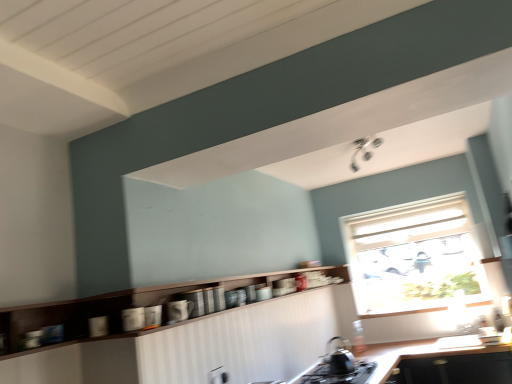
The image size is (512, 384). Find the location of `glossy ceramic mug at lower center, the first appliance viewed from the front`. glossy ceramic mug at lower center, the first appliance viewed from the front is located at coordinates [179, 310].

What is the approximate width of glossy ceramic mug at lower center, the first appliance viewed from the front?

4.16 inches.

The height and width of the screenshot is (384, 512). Find the location of `white textured window at upper right`. white textured window at upper right is located at coordinates click(x=415, y=256).

Find the location of a particular element. The height and width of the screenshot is (384, 512). black matte countertop at lower center is located at coordinates (438, 364).

At what (x,y) coordinates should I click in order to perform the action: click on wooden cabinet at center. Please return your answer as a coordinate pair (x, y). The height and width of the screenshot is (384, 512). Looking at the image, I should click on (104, 311).

From the image's perspective, between black matte gas stove at lower center and matte ceramic mug at center, positioned as the first appliance in back-to-front order, who is located below?

black matte gas stove at lower center, from the image's perspective.

From the picture: Is black matte gas stove at lower center inside the boundaries of matte ceramic mug at center, marked as the second appliance in a front-to-back arrangement, or outside?

black matte gas stove at lower center is spatially situated outside matte ceramic mug at center, marked as the second appliance in a front-to-back arrangement.

Is point (368, 378) in front of point (194, 297)?

No, (368, 378) is further to viewer.

Locate an element on the screen. gas stove positioned vertically above the black matte countertop at lower center (from a real-world perspective) is located at coordinates (340, 374).

Considering the relative positions of black matte countertop at lower center and black matte gas stove at lower center in the image provided, is black matte countertop at lower center to the right of black matte gas stove at lower center from the viewer's perspective?

Yes.

From a real-world perspective, which is physically below, black matte countertop at lower center or black matte gas stove at lower center?

black matte countertop at lower center is physically lower.

Is black matte gas stove at lower center completely or partially inside black matte countertop at lower center?

Yes, black matte gas stove at lower center can be found within black matte countertop at lower center.

Is white textured window at upper right to the left or to the right of black matte gas stove at lower center in the image?

white textured window at upper right is to the right of black matte gas stove at lower center.

Consider the image. Which is less distant, (x=454, y=297) or (x=368, y=365)?

Clearly, point (x=454, y=297) is more distant from the camera than point (x=368, y=365).

Is white textured window at upper right completely or partially outside of black matte gas stove at lower center?

Yes.

In the image, is white textured window at upper right positioned in front of or behind black matte gas stove at lower center?

Visually, white textured window at upper right is located behind black matte gas stove at lower center.

From the image's perspective, is black matte tea pot at lower center located beneath black matte countertop at lower center?

Actually, black matte tea pot at lower center appears above black matte countertop at lower center in the image.

Which is correct: black matte tea pot at lower center is inside black matte countertop at lower center, or outside of it?

black matte tea pot at lower center is not inside black matte countertop at lower center, it's outside.

Which of these two, black matte tea pot at lower center or black matte countertop at lower center, is thinner?

black matte tea pot at lower center.

From the image's perspective, relative to white textured window at upper right, is wooden cabinet at center above or below?

Based on their image positions, wooden cabinet at center is located beneath white textured window at upper right.

Between point (173, 284) and point (451, 292), which one is positioned in front?

Point (173, 284)

Can you confirm if wooden cabinet at center is shorter than white textured window at upper right?

Correct, wooden cabinet at center is not as tall as white textured window at upper right.

Is wooden cabinet at center facing towards white textured window at upper right?

Yes, wooden cabinet at center is turned towards white textured window at upper right.

You are a GUI agent. You are given a task and a screenshot of the screen. Output one action in this format:
    pyautogui.click(x=<x>, y=<y>)
    Task: Click on the countertop below the black matte tea pot at lower center (from a real-world perspective)
    
    Given the screenshot: What is the action you would take?
    pyautogui.click(x=438, y=364)

Is black matte countertop at lower center far away from black matte tea pot at lower center?

No, black matte countertop at lower center is in close proximity to black matte tea pot at lower center.

Could you tell me if black matte countertop at lower center is facing black matte tea pot at lower center?

No.

From the picture: Considering the positions of objects black matte countertop at lower center and black matte tea pot at lower center in the image provided, who is more to the right, black matte countertop at lower center or black matte tea pot at lower center?

From the viewer's perspective, black matte countertop at lower center appears more on the right side.

Can you see glossy ceramic mug at lower center, the first appliance viewed from the front, touching black matte countertop at lower center?

No, glossy ceramic mug at lower center, the first appliance viewed from the front, is not next to black matte countertop at lower center.

Is glossy ceramic mug at lower center, the 2th appliance in the back-to-front sequence, wider than black matte countertop at lower center?

No, glossy ceramic mug at lower center, the 2th appliance in the back-to-front sequence, is not wider than black matte countertop at lower center.

The height and width of the screenshot is (384, 512). What are the coordinates of `appliance that is the 1st one above the black matte countertop at lower center (from a real-world perspective)` in the screenshot? It's located at (179, 310).

Can you confirm if glossy ceramic mug at lower center, the 2th appliance in the back-to-front sequence, is bigger than black matte countertop at lower center?

No.

Locate an element on the screen. The image size is (512, 384). appliance that is the 2nd object above the black matte gas stove at lower center (from a real-world perspective) is located at coordinates (194, 302).

This screenshot has width=512, height=384. I want to click on gas stove above the black matte countertop at lower center (from the image's perspective), so click(x=340, y=374).

Considering their positions, is glossy ceramic mug at lower center, the 2th appliance in the back-to-front sequence, positioned further to black matte gas stove at lower center than wooden cabinet at center?

glossy ceramic mug at lower center, the 2th appliance in the back-to-front sequence, lies further to black matte gas stove at lower center than the other object.

Based on their spatial positions, is wooden cabinet at center or black matte gas stove at lower center further from black matte tea pot at lower center?

The object further to black matte tea pot at lower center is wooden cabinet at center.

Based on the photo, estimate the real-world distances between objects in this image. Which object is further from wooden cabinet at center, black matte tea pot at lower center or matte ceramic mug at center, positioned as the first appliance in back-to-front order?

black matte tea pot at lower center is further to wooden cabinet at center.

Based on their spatial positions, is black matte countertop at lower center or glossy ceramic mug at lower center, the first appliance viewed from the front, further from matte ceramic mug at center, positioned as the first appliance in back-to-front order?

black matte countertop at lower center is further to matte ceramic mug at center, positioned as the first appliance in back-to-front order.

Based on the photo, based on their spatial positions, is black matte tea pot at lower center or white textured window at upper right closer to black matte countertop at lower center?

Based on the image, black matte tea pot at lower center appears to be nearer to black matte countertop at lower center.

Estimate the real-world distances between objects in this image. Which object is further from black matte tea pot at lower center, black matte gas stove at lower center or wooden cabinet at center?

Based on the image, wooden cabinet at center appears to be further to black matte tea pot at lower center.

Looking at the image, which one is located further to black matte countertop at lower center, black matte gas stove at lower center or matte ceramic mug at center, positioned as the first appliance in back-to-front order?

matte ceramic mug at center, positioned as the first appliance in back-to-front order, lies further to black matte countertop at lower center than the other object.

From the image, which object appears to be farther from white textured window at upper right, black matte gas stove at lower center or black matte tea pot at lower center?

The object further to white textured window at upper right is black matte tea pot at lower center.

I want to click on gas stove situated between matte ceramic mug at center, marked as the second appliance in a front-to-back arrangement, and black matte countertop at lower center from left to right, so tap(340, 374).

The width and height of the screenshot is (512, 384). Identify the location of appliance between glossy ceramic mug at lower center, the 2th appliance in the back-to-front sequence, and white textured window at upper right from left to right. (194, 302).

Identify the location of appliance situated between glossy ceramic mug at lower center, the first appliance viewed from the front, and black matte tea pot at lower center from left to right. (194, 302).

Image resolution: width=512 pixels, height=384 pixels. I want to click on tea pot positioned between wooden cabinet at center and white textured window at upper right from near to far, so click(339, 358).